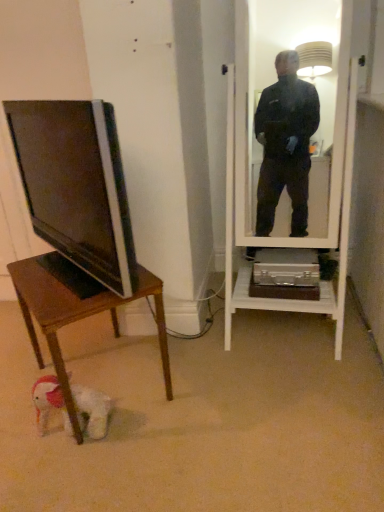
Where is `free point to the right of white plush dog at lower left`? The height and width of the screenshot is (512, 384). free point to the right of white plush dog at lower left is located at coordinates (132, 434).